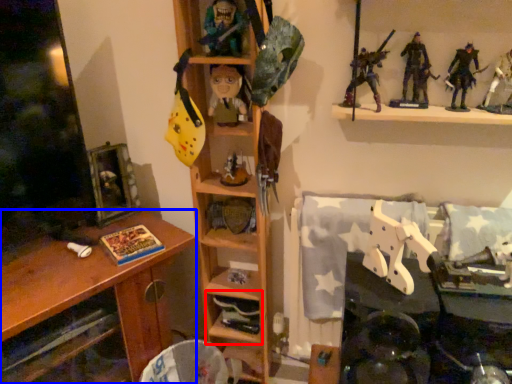
Question: Which object appears farthest to the camera in this image, shelf (highlighted by a red box) or desk (highlighted by a blue box)?

Choices:
 (A) shelf
 (B) desk

Answer: (A)